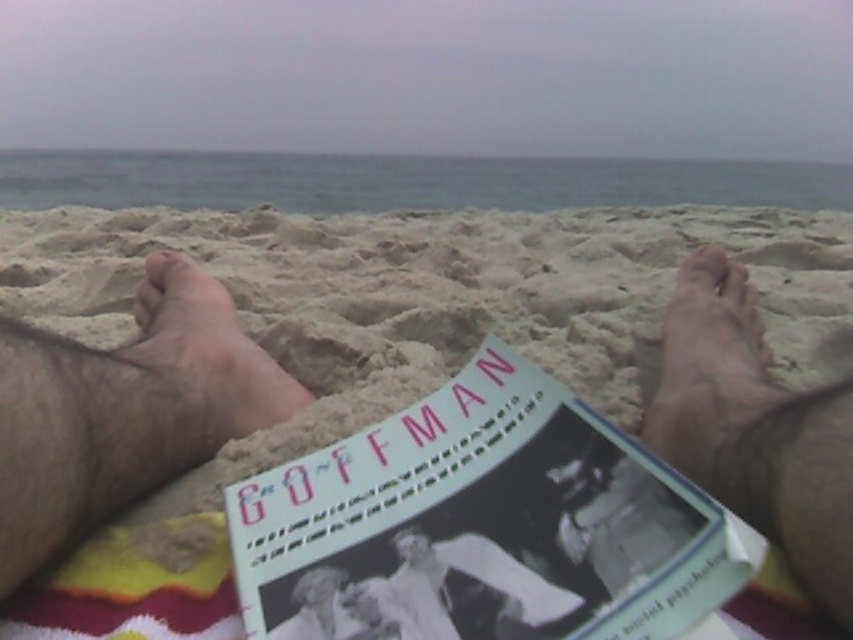
You are a beachgoer who wants to set up your beach umbrella. You have two options for locations based on the sand types shown. If you choose the beige sand at center, will it be higher or lower than the dry sand at right where you might place your towel?

The beige sand at center is located above the dry sand at right, so setting up the umbrella there would place it higher than the dry sand at right where the towel might be placed.

You are a person who wants to place a white paper book at center on the beige sand at center. Can you fit the book entirely on the sand without any part hanging off?

The beige sand at center has a larger width than the white paper book at center, so yes, the book can be placed entirely on the sand without any part hanging off.

In the scene shown: You are a beachgoer who wants to set up your beach umbrella. You have two options for placement based on the sand types shown. Which location would be more elevated and thus less likely to flood during high tide? Please choose between the beige sand at center and the dry sand at right.

The beige sand at center is taller than the dry sand at right, so the beige sand at center would be more elevated and less likely to flood during high tide.